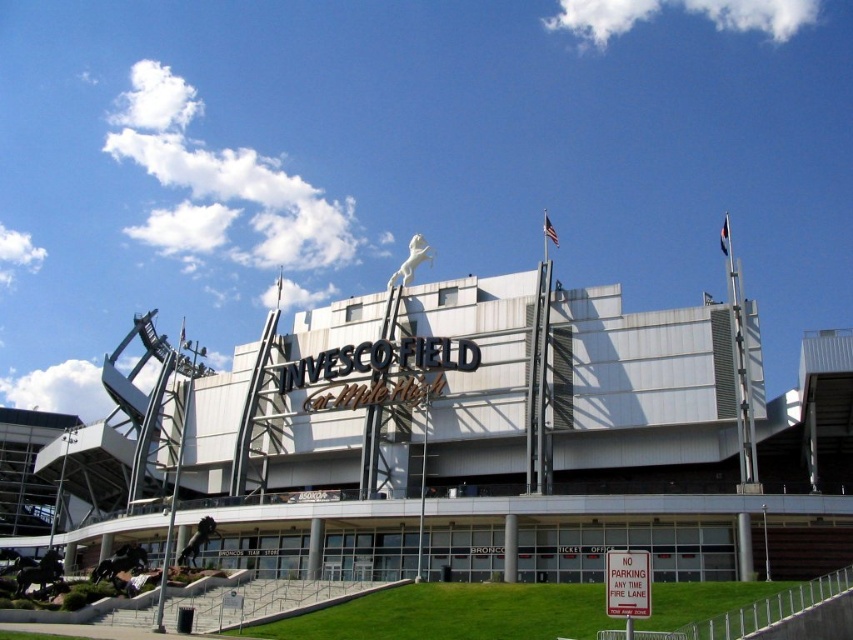
Question: Does white metallic building at center appear under bronze statue at lower center?

Choices:
 (A) no
 (B) yes

Answer: (A)

Question: From the image, what is the correct spatial relationship of white glossy horse at upper center in relation to bronze statue at lower center?

Choices:
 (A) below
 (B) above

Answer: (B)

Question: Which is farther from the white metallic building at center?

Choices:
 (A) white glossy horse at upper center
 (B) polished bronze horse at lower left
 (C) bronze statue at lower center
 (D) bronze horse statue at lower left

Answer: (A)

Question: Which of the following is the farthest from the observer?

Choices:
 (A) bronze horse statue at lower left
 (B) white metallic building at center
 (C) polished bronze horse at lower left

Answer: (A)

Question: Is polished bronze horse at lower left to the right of bronze horse statue at lower left from the viewer's perspective?

Choices:
 (A) yes
 (B) no

Answer: (B)

Question: Which object is farther from the camera taking this photo?

Choices:
 (A) bronze horse statue at lower left
 (B) bronze statue at lower center
 (C) white metallic building at center

Answer: (B)